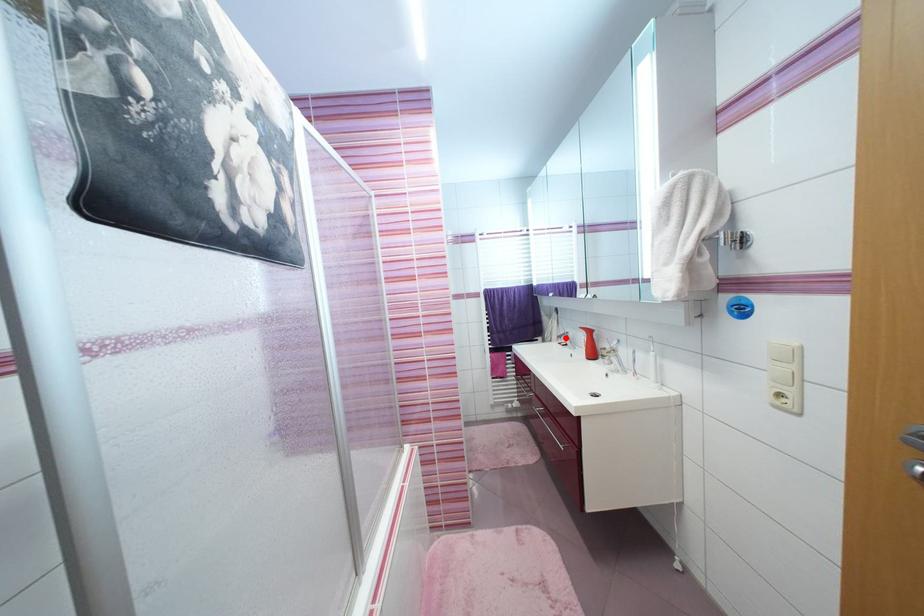
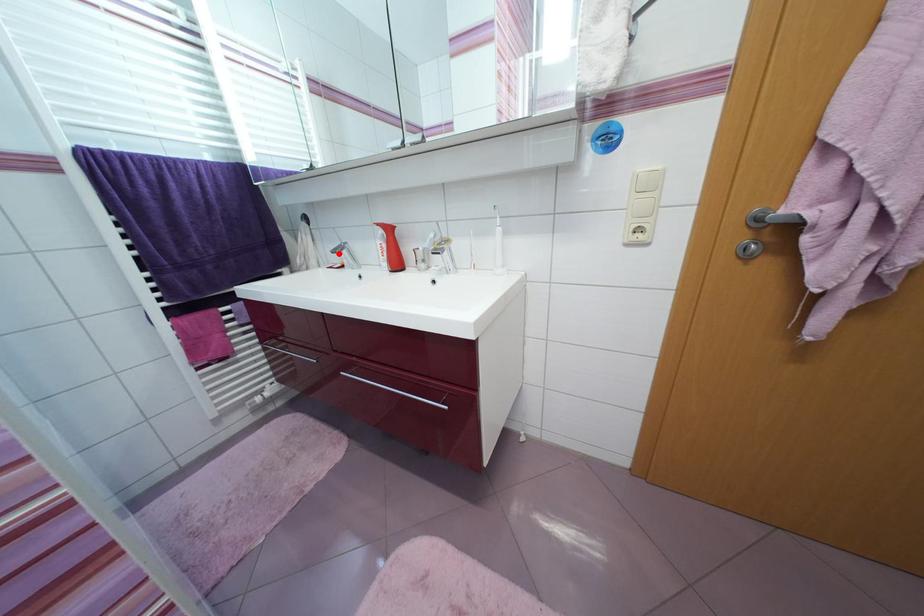
I am providing you with two images of the same scene from different viewpoints. A red point is marked on the first image and another point is marked on the second image. Does the point marked in image1 correspond to the same location as the one in image2?

Yes